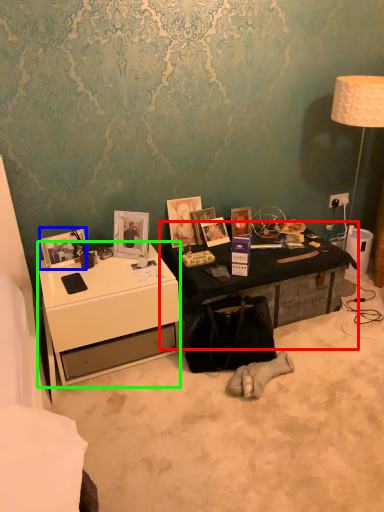
Question: Which is farther away from table (highlighted by a red box)? picture frame (highlighted by a blue box) or desk (highlighted by a green box)?

Choices:
 (A) picture frame
 (B) desk

Answer: (A)